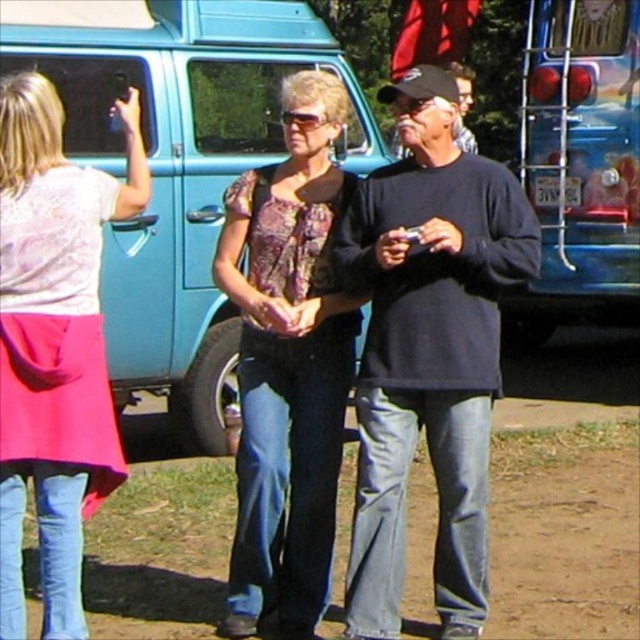
Question: Which of the following is the closest to the observer?

Choices:
 (A) matte floral blouse at center
 (B) black cotton shirt at center
 (C) blue metallic van at upper right
 (D) pink fabric skirt at left

Answer: (D)

Question: Where is teal matte van at center located in relation to blue metallic van at upper right in the image?

Choices:
 (A) below
 (B) above

Answer: (A)

Question: Does black cotton shirt at center appear on the left side of pink fabric skirt at left?

Choices:
 (A) no
 (B) yes

Answer: (A)

Question: Among these objects, which one is nearest to the camera?

Choices:
 (A) teal matte van at center
 (B) matte floral blouse at center
 (C) blue metallic van at upper right
 (D) black cotton shirt at center

Answer: (D)

Question: Which of the following is the closest to the observer?

Choices:
 (A) (256, 602)
 (B) (65, 397)

Answer: (B)

Question: Does teal matte van at center lie in front of pink fabric skirt at left?

Choices:
 (A) yes
 (B) no

Answer: (B)